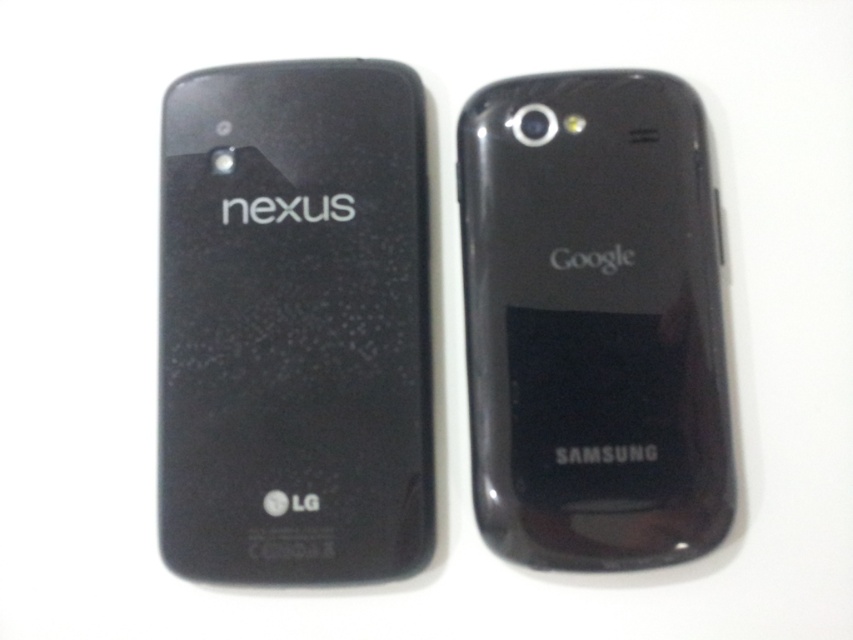
Who is lower down, matte black nexus phone at left or glossy black phone at center?

matte black nexus phone at left is below.

In the scene shown: Can you confirm if matte black nexus phone at left is positioned to the left of glossy black phone at center?

Yes, matte black nexus phone at left is to the left of glossy black phone at center.

Is point (251, 566) more distant than point (566, 241)?

No.

The height and width of the screenshot is (640, 853). What are the coordinates of `matte black nexus phone at left` in the screenshot? It's located at (294, 324).